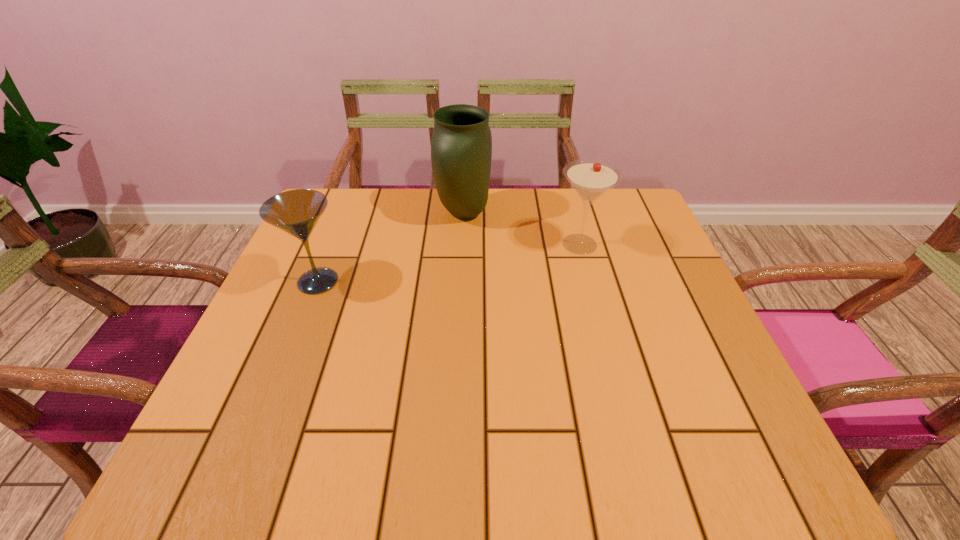
I want to click on martini that is at the far edge, so click(x=590, y=178).

Locate an element on the screen. The width and height of the screenshot is (960, 540). object positioned at the left edge is located at coordinates (296, 212).

This screenshot has height=540, width=960. In order to click on object positioned at the right edge in this screenshot , I will do `click(590, 178)`.

Identify the location of object situated at the far right corner. (590, 178).

Locate an element on the screen. vacant space at the far edge of the desktop is located at coordinates (400, 197).

In the image, there is a desktop. At what (x,y) coordinates should I click in order to perform the action: click on vacant space at the near edge. Please return your answer as a coordinate pair (x, y). This screenshot has height=540, width=960. Looking at the image, I should click on (426, 465).

In the image, there is a desktop. Find the location of `vacant region at the left edge`. vacant region at the left edge is located at coordinates point(223,387).

This screenshot has width=960, height=540. Identify the location of blank area at the right edge. (637, 267).

In the image, there is a desktop. Where is `free space at the far left corner`? This screenshot has width=960, height=540. free space at the far left corner is located at coordinates (345, 234).

Find the location of `free space at the far right corner of the desktop`. free space at the far right corner of the desktop is located at coordinates (646, 218).